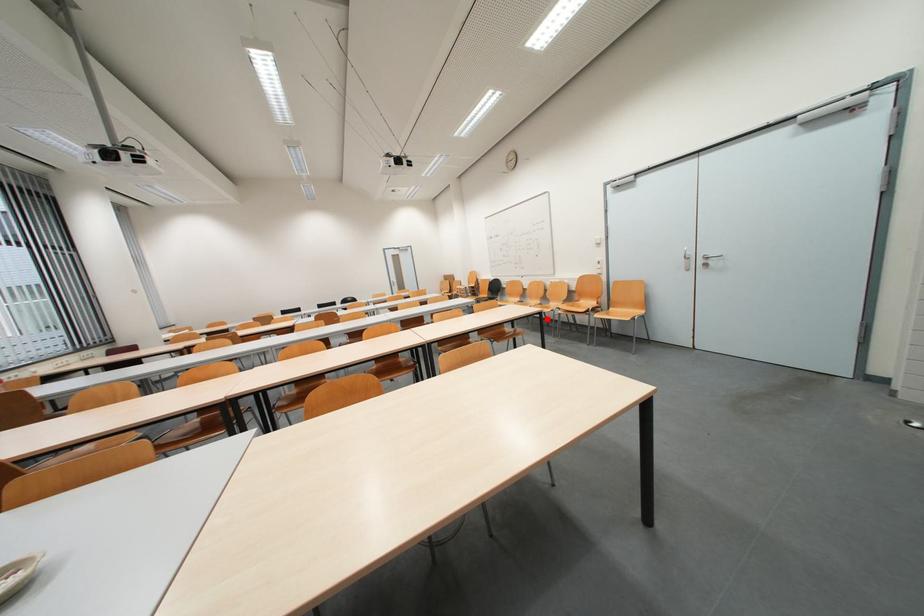
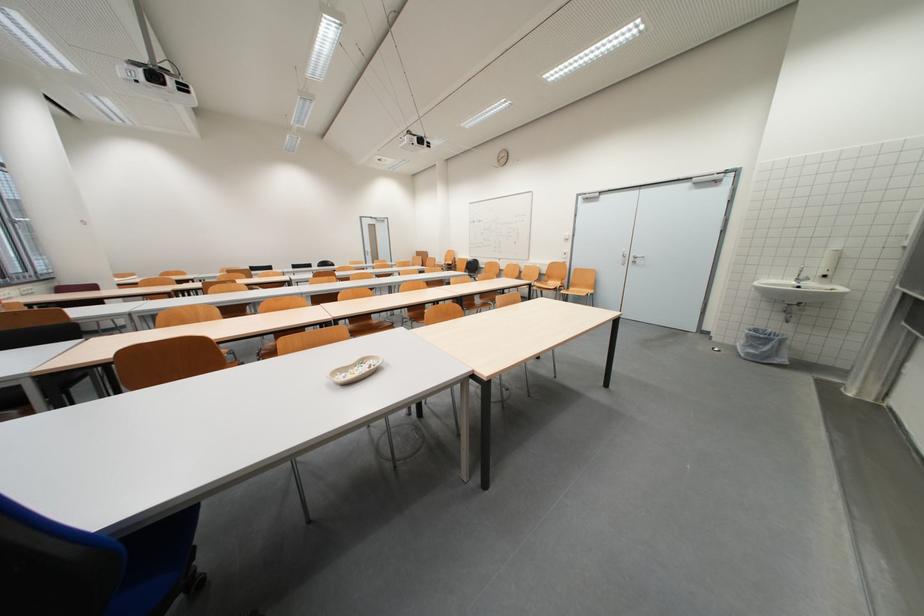
Question: I am providing you with two images of the same scene from different viewpoints. A red point is shown in image1. For the corresponding object point in image2, is it positioned nearer or farther from the camera?

Choices:
 (A) Nearer
 (B) Farther

Answer: (B)